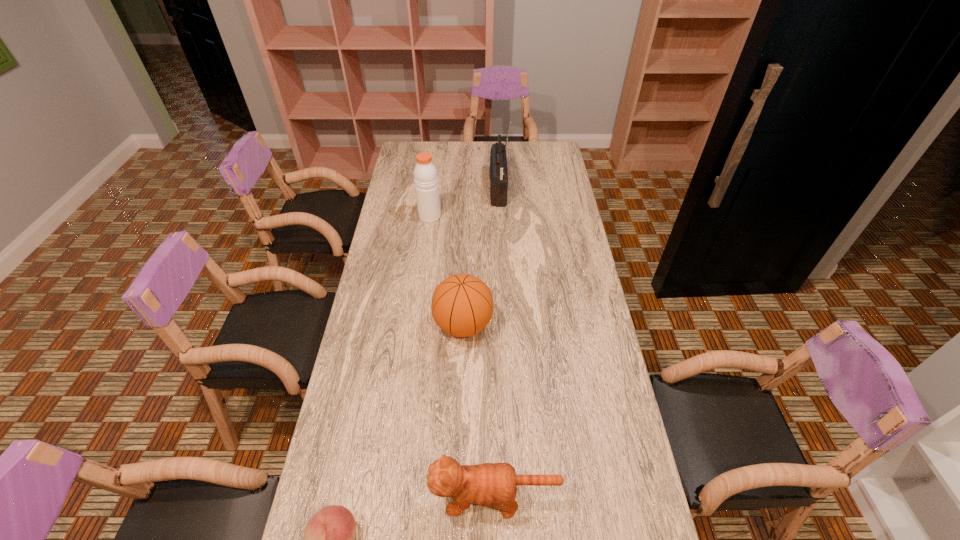
The height and width of the screenshot is (540, 960). In order to click on free space between the shaker and the radio receiver in this screenshot , I will do `click(464, 203)`.

At what (x,y) coordinates should I click in order to perform the action: click on empty location between the basketball and the tallest object. Please return your answer as a coordinate pair (x, y). Looking at the image, I should click on (481, 258).

The width and height of the screenshot is (960, 540). Find the location of `the second closest object relative to the cat`. the second closest object relative to the cat is located at coordinates (462, 305).

Locate an element on the screen. object identified as the second closest to the third nearest object is located at coordinates (425, 173).

Locate an element on the screen. Image resolution: width=960 pixels, height=540 pixels. free space that satisfies the following two spatial constraints: 1. on the front-facing side of the radio receiver; 2. on the front side of the fourth shortest object is located at coordinates (499, 216).